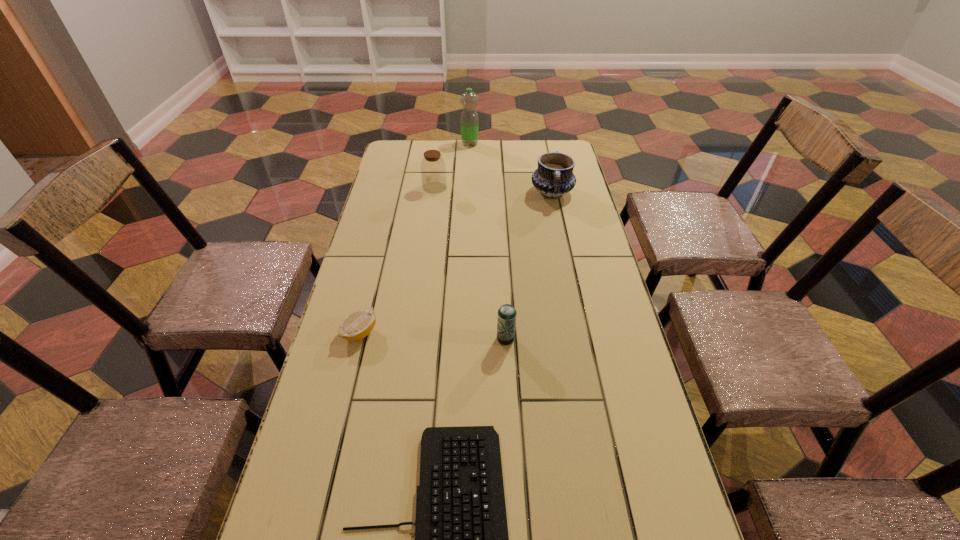
Locate an element on the screen. This screenshot has height=540, width=960. vacant space located on the front of the beer can is located at coordinates (513, 467).

This screenshot has width=960, height=540. Find the location of `vacant area situated on the back of the leftmost object`. vacant area situated on the back of the leftmost object is located at coordinates (384, 235).

You are a GUI agent. You are given a task and a screenshot of the screen. Output one action in this format:
    pyautogui.click(x=<x>, y=<y>)
    Task: Click on the object that is at the far edge
    This screenshot has height=540, width=960.
    Given the screenshot: What is the action you would take?
    469,117

Where is `object that is at the left edge`? The image size is (960, 540). object that is at the left edge is located at coordinates (358, 324).

What are the coordinates of `object that is at the right edge` in the screenshot? It's located at (554, 177).

In the image, there is a desktop. Identify the location of vacant area at the left edge. The height and width of the screenshot is (540, 960). (401, 219).

Identify the location of vacant space at the right edge. The height and width of the screenshot is (540, 960). (544, 211).

The height and width of the screenshot is (540, 960). Find the location of `vacant space at the far right corner`. vacant space at the far right corner is located at coordinates (532, 139).

The image size is (960, 540). Identify the location of empty location between the jar and the lemon. (397, 260).

The height and width of the screenshot is (540, 960). What are the coordinates of `unoccupied position between the tallest object and the third shortest object` in the screenshot? It's located at (488, 241).